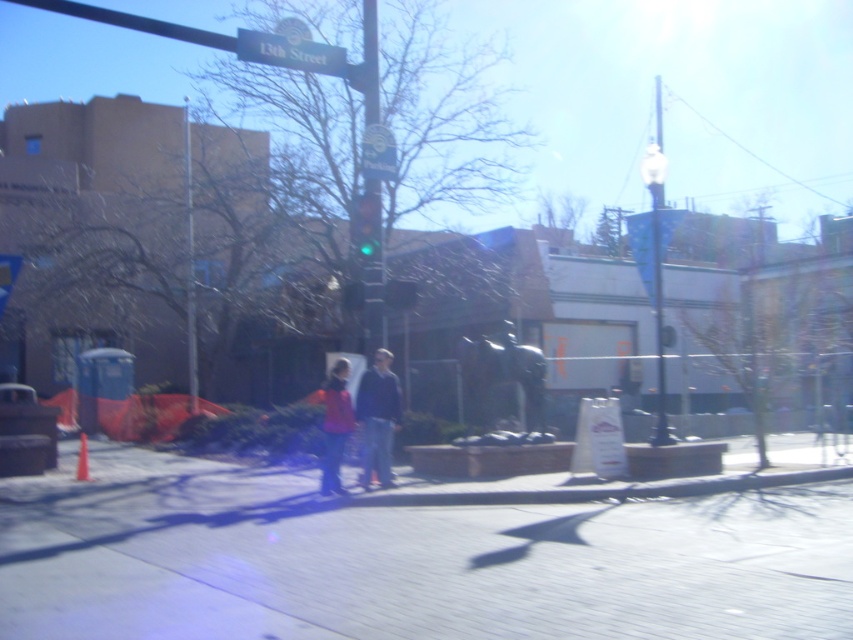
Between metallic pole at center and matte red jacket at center, which one is positioned lower?

matte red jacket at center is below.

Which is above, metallic pole at center or matte red jacket at center?

metallic pole at center is higher up.

In order to click on metallic pole at center in this screenshot , I will do `click(372, 262)`.

Which of these two, green plastic street sign at upper center or metallic pole at upper right, stands shorter?

green plastic street sign at upper center

Is green plastic street sign at upper center behind metallic pole at upper right?

No, it is not.

Is point (251, 42) in front of point (657, 424)?

Yes, point (251, 42) is closer to viewer.

Locate an element on the screen. This screenshot has width=853, height=640. green plastic street sign at upper center is located at coordinates (289, 52).

Can you confirm if green glass traffic light at center is positioned above blue plastic parking sign at upper center?

No, green glass traffic light at center is not above blue plastic parking sign at upper center.

Is green glass traffic light at center behind blue plastic parking sign at upper center?

No, it is in front of blue plastic parking sign at upper center.

Does point (372, 241) come behind point (374, 156)?

No, it is not.

Locate an element on the screen. This screenshot has width=853, height=640. green glass traffic light at center is located at coordinates (364, 225).